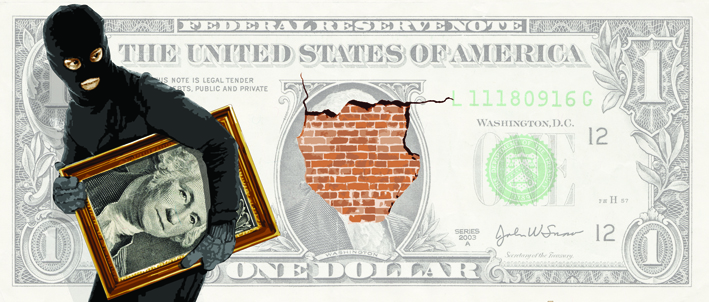
Where is `brick wall`? The image size is (709, 302). brick wall is located at coordinates 357,143.